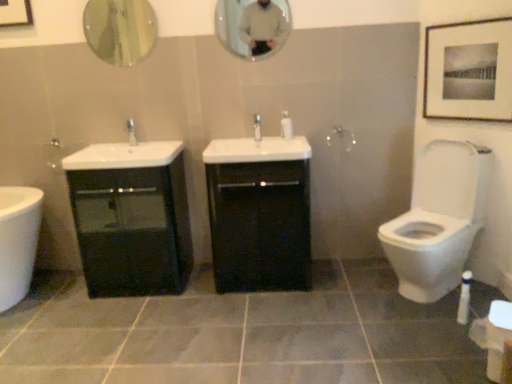
Question: Is white glossy soap dispenser at center positioned beyond the bounds of matte silver faucet at center, the first tap when ordered from left to right?

Choices:
 (A) no
 (B) yes

Answer: (B)

Question: Is white glossy soap dispenser at center aimed at matte silver faucet at center, which ranks as the 2th tap in right-to-left order?

Choices:
 (A) no
 (B) yes

Answer: (A)

Question: Is white glossy soap dispenser at center taller than matte silver faucet at center, which ranks as the 2th tap in right-to-left order?

Choices:
 (A) yes
 (B) no

Answer: (A)

Question: Is matte silver faucet at center, the first tap when ordered from left to right, inside white glossy soap dispenser at center?

Choices:
 (A) no
 (B) yes

Answer: (A)

Question: Considering the relative sizes of white glossy soap dispenser at center and matte silver faucet at center, which ranks as the 2th tap in right-to-left order, in the image provided, is white glossy soap dispenser at center thinner than matte silver faucet at center, which ranks as the 2th tap in right-to-left order,?

Choices:
 (A) no
 (B) yes

Answer: (B)

Question: Does point (258, 117) appear closer or farther from the camera than point (130, 134)?

Choices:
 (A) closer
 (B) farther

Answer: (A)

Question: From the image's perspective, is white glossy tap at center, the 2th tap positioned from the left, positioned above or below matte silver faucet at center, the first tap when ordered from left to right?

Choices:
 (A) below
 (B) above

Answer: (B)

Question: In the image, is white glossy tap at center, the first tap in the right-to-left sequence, on the left side or the right side of matte silver faucet at center, the first tap when ordered from left to right?

Choices:
 (A) left
 (B) right

Answer: (B)

Question: Looking at their shapes, would you say white glossy tap at center, the first tap in the right-to-left sequence, is wider or thinner than matte silver faucet at center, which ranks as the 2th tap in right-to-left order?

Choices:
 (A) wide
 (B) thin

Answer: (B)

Question: In terms of size, does matte black picture frame at upper right appear bigger or smaller than matte glass mirror at upper center, the first mirror viewed from the right?

Choices:
 (A) small
 (B) big

Answer: (B)

Question: In terms of height, does matte black picture frame at upper right look taller or shorter compared to matte glass mirror at upper center, the first mirror viewed from the right?

Choices:
 (A) short
 (B) tall

Answer: (B)

Question: From the image's perspective, relative to matte glass mirror at upper center, which appears as the 2th mirror when viewed from the left, is matte black picture frame at upper right above or below?

Choices:
 (A) below
 (B) above

Answer: (A)

Question: Is matte black picture frame at upper right to the left or to the right of matte glass mirror at upper center, the first mirror viewed from the right, in the image?

Choices:
 (A) left
 (B) right

Answer: (B)

Question: In terms of size, does black glossy cabinet at center, which is counted as the 2th bathroom cabinet, starting from the left, appear bigger or smaller than gray matte tile at center?

Choices:
 (A) big
 (B) small

Answer: (B)

Question: Is black glossy cabinet at center, which is counted as the 2th bathroom cabinet, starting from the left, in front of or behind gray matte tile at center in the image?

Choices:
 (A) front
 (B) behind

Answer: (B)